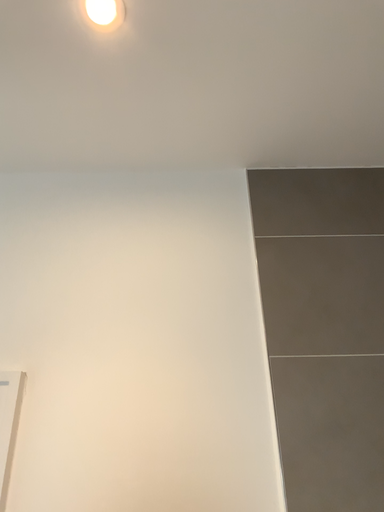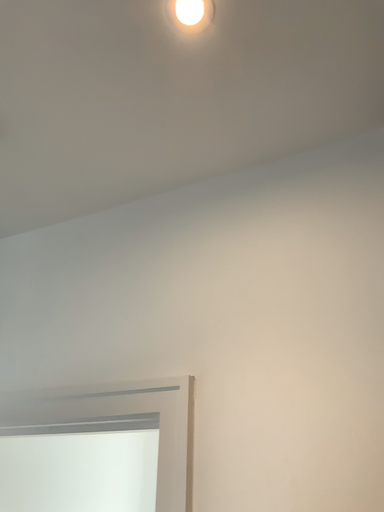
Question: Which way did the camera rotate in the video?

Choices:
 (A) rotated right
 (B) rotated left

Answer: (B)